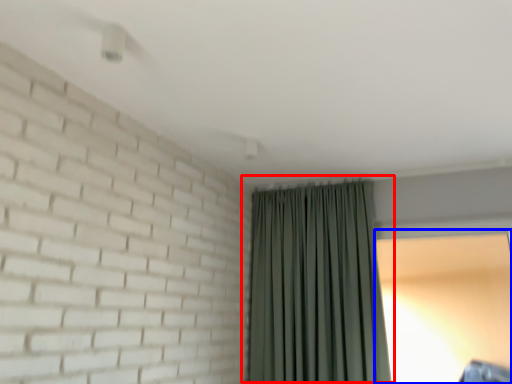
Question: Which object is closer to the camera taking this photo, curtain (highlighted by a red box) or window screen (highlighted by a blue box)?

Choices:
 (A) curtain
 (B) window screen

Answer: (A)